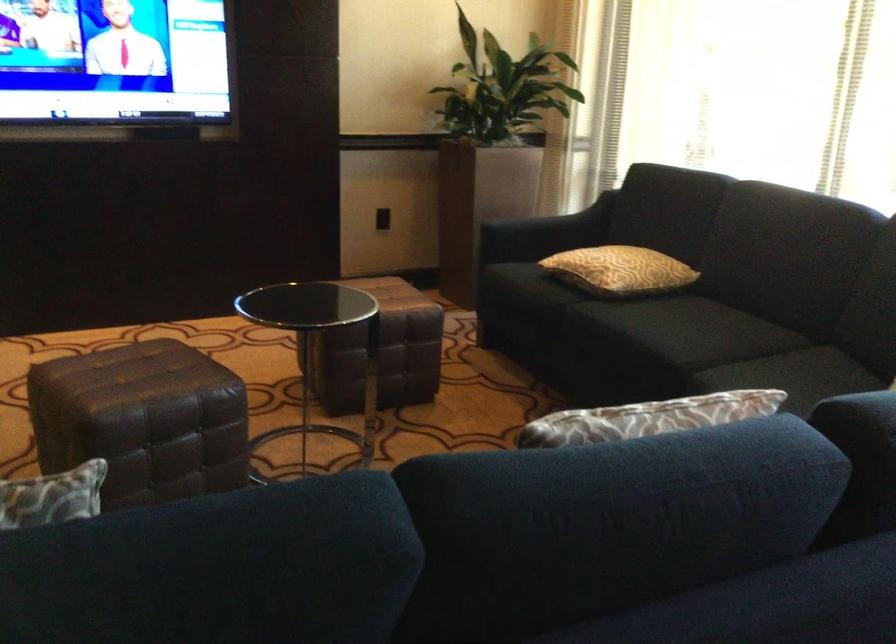
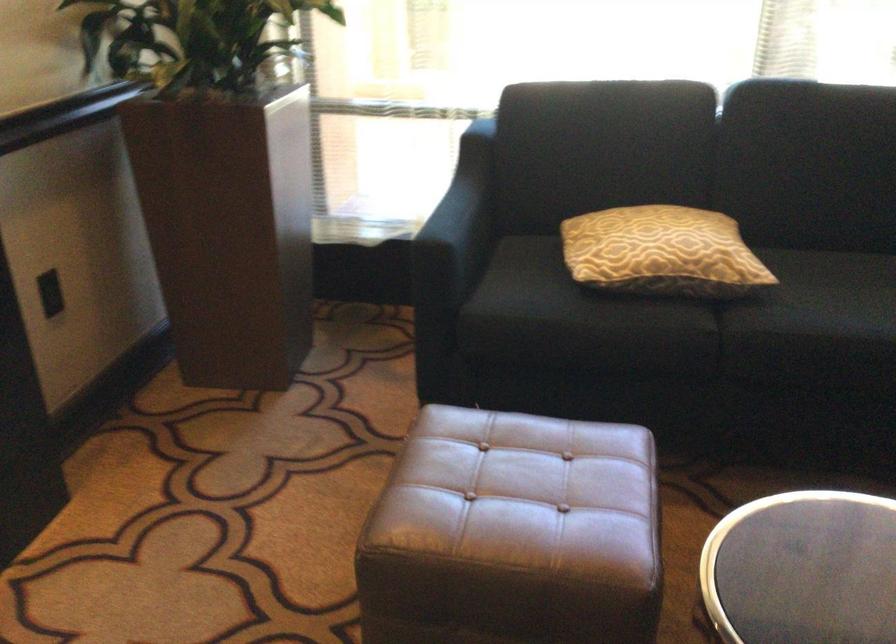
Find the pixel in the second image that matches [614,294] in the first image.

(752, 289)